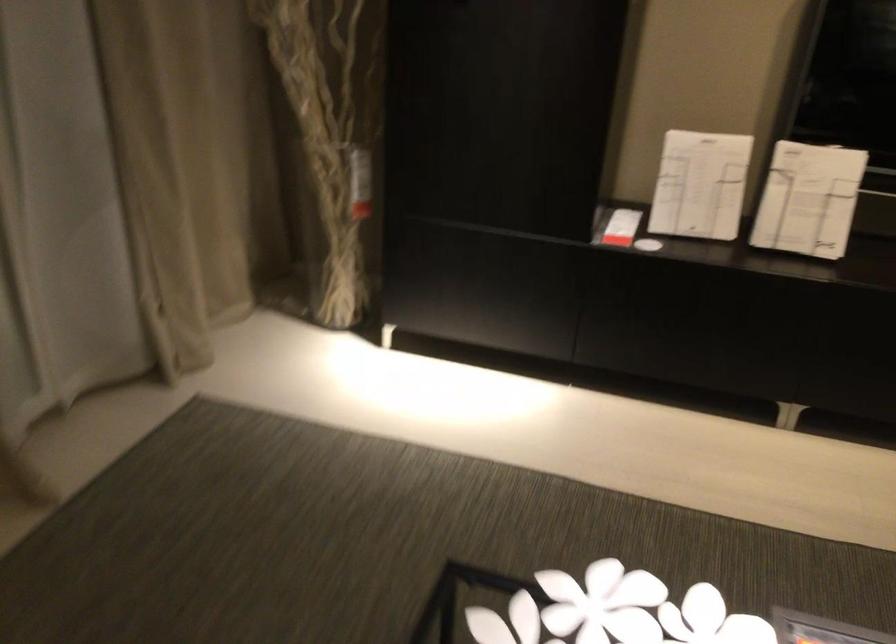
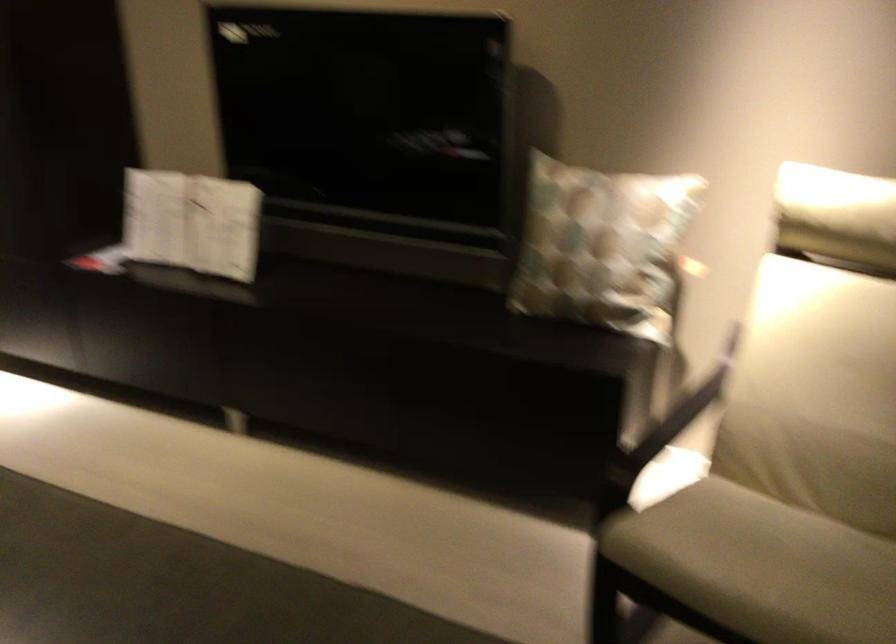
In the second image, find the point that corresponds to point 761,187 in the first image.

(192, 222)